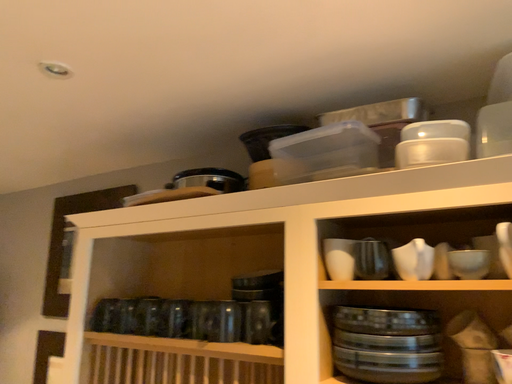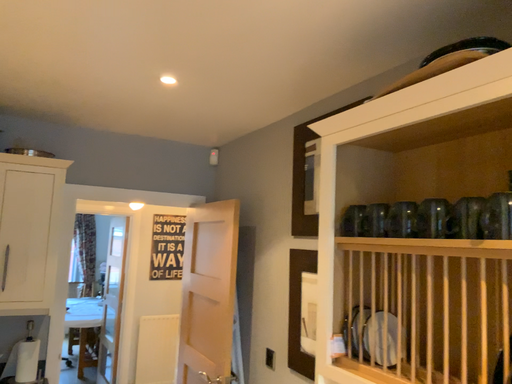
Question: Which way did the camera rotate in the video?

Choices:
 (A) rotated right
 (B) rotated left

Answer: (B)